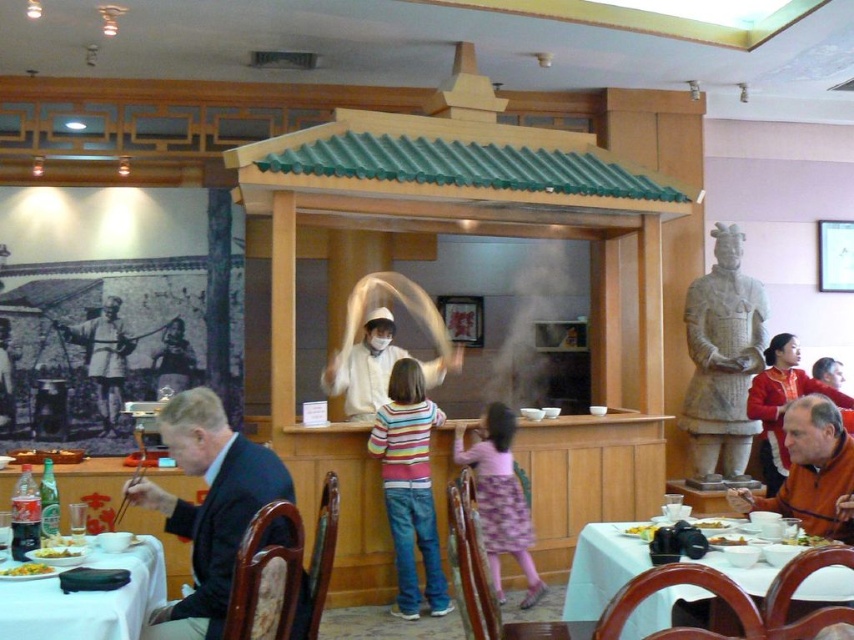
You are a photographer standing in the restaurant and want to take a picture of both the camera on the table and the person making dough. Which object is closer to you, the point representing the camera at point (636, 536) or the point representing the person making dough at point (728, 545)?

The point representing the camera at point (636, 536) is closer to you than the point representing the person making dough at point (728, 545) because it is further to the viewer.

You are a customer sitting at the table in the restaurant scene. You notice two points marked on the floor. The first point is at coordinate point(16, 570) and the second is at point(718, 522). If you want to reach the point that is closer to you, which coordinate should you go to?

You should go to point(16, 570) because it is in front of point(718, 522), meaning it is closer to your current position as a customer sitting at the table.

You are a photographer who needs to capture a group photo of the dark blue suit at left and the pink floral dress at center. Since the camera is on the table, you can only adjust your position. Which side should you stand to ensure both subjects are fully visible without cropping either?

You should stand on the side of the dark blue suit at left because its width is larger than the pink floral dress at center, allowing you to position yourself to include both subjects fully without cropping.